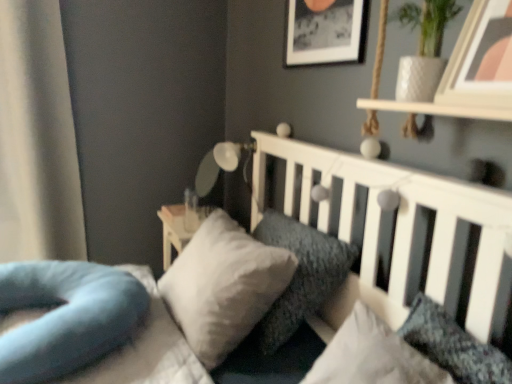
Question: Does textured gray pillow at center, the 4th pillow from the left, have a larger size compared to white soft pillow at center, which appears as the third pillow when viewed from the right?

Choices:
 (A) no
 (B) yes

Answer: (A)

Question: Is textured gray pillow at center, positioned as the 1th pillow in right-to-left order, to the left of white soft pillow at center, which appears as the third pillow when viewed from the right, from the viewer's perspective?

Choices:
 (A) yes
 (B) no

Answer: (B)

Question: Is textured gray pillow at center, the 4th pillow from the left, outside of white soft pillow at center, which appears as the third pillow when viewed from the right?

Choices:
 (A) no
 (B) yes

Answer: (B)

Question: From the image's perspective, would you say textured gray pillow at center, positioned as the 1th pillow in right-to-left order, is shown under white soft pillow at center, which appears as the third pillow when viewed from the right?

Choices:
 (A) yes
 (B) no

Answer: (A)

Question: Is textured gray pillow at center, positioned as the 1th pillow in right-to-left order, looking in the opposite direction of white soft pillow at center, the second pillow positioned from the left?

Choices:
 (A) yes
 (B) no

Answer: (B)

Question: Can you confirm if textured gray pillow at center, the 4th pillow from the left, is positioned to the right of white soft pillow at center, which appears as the third pillow when viewed from the right?

Choices:
 (A) yes
 (B) no

Answer: (A)

Question: Can you confirm if white soft bed at center is thinner than textured gray pillow at center, positioned as the 1th pillow in right-to-left order?

Choices:
 (A) yes
 (B) no

Answer: (B)

Question: Considering the relative sizes of white soft bed at center and textured gray pillow at center, positioned as the 1th pillow in right-to-left order, in the image provided, is white soft bed at center bigger than textured gray pillow at center, positioned as the 1th pillow in right-to-left order,?

Choices:
 (A) yes
 (B) no

Answer: (A)

Question: Does white soft bed at center have a smaller size compared to textured gray pillow at center, the 4th pillow from the left?

Choices:
 (A) yes
 (B) no

Answer: (B)

Question: Considering the relative positions of white soft bed at center and textured gray pillow at center, positioned as the 1th pillow in right-to-left order, in the image provided, is white soft bed at center to the left of textured gray pillow at center, positioned as the 1th pillow in right-to-left order, from the viewer's perspective?

Choices:
 (A) no
 (B) yes

Answer: (B)

Question: From the image's perspective, is white soft bed at center located above textured gray pillow at center, the 4th pillow from the left?

Choices:
 (A) no
 (B) yes

Answer: (B)

Question: Is white soft bed at center next to textured gray pillow at center, positioned as the 1th pillow in right-to-left order?

Choices:
 (A) yes
 (B) no

Answer: (B)

Question: Is soft gray pillow at center, which is counted as the 2th pillow, starting from the right, at the back of white glossy lamp at upper center?

Choices:
 (A) no
 (B) yes

Answer: (A)